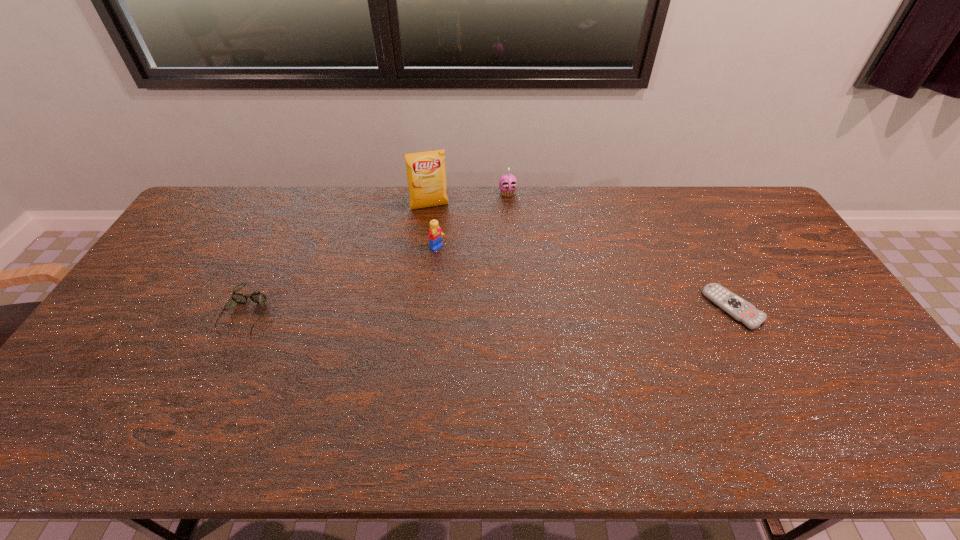
The height and width of the screenshot is (540, 960). I want to click on spectacles, so click(x=257, y=297).

This screenshot has width=960, height=540. In order to click on the leftmost object in this screenshot , I will do `click(257, 297)`.

Locate an element on the screen. This screenshot has width=960, height=540. the shortest object is located at coordinates (739, 309).

Image resolution: width=960 pixels, height=540 pixels. Identify the location of remote control. (739, 309).

This screenshot has width=960, height=540. Find the location of `crisp (potato chip)`. crisp (potato chip) is located at coordinates (426, 174).

I want to click on the tallest object, so click(426, 174).

Identify the location of the farthest object. The width and height of the screenshot is (960, 540). (507, 183).

Image resolution: width=960 pixels, height=540 pixels. I want to click on cupcake, so click(507, 183).

This screenshot has height=540, width=960. What are the coordinates of `Lego` in the screenshot? It's located at (435, 233).

Locate an element on the screen. vacant space situated on the front-facing side of the leftmost object is located at coordinates (214, 382).